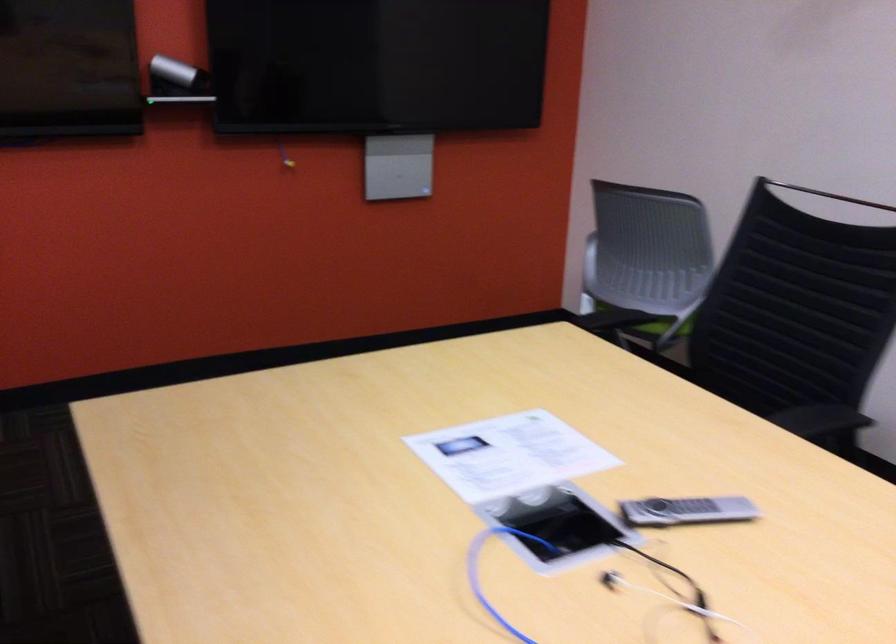
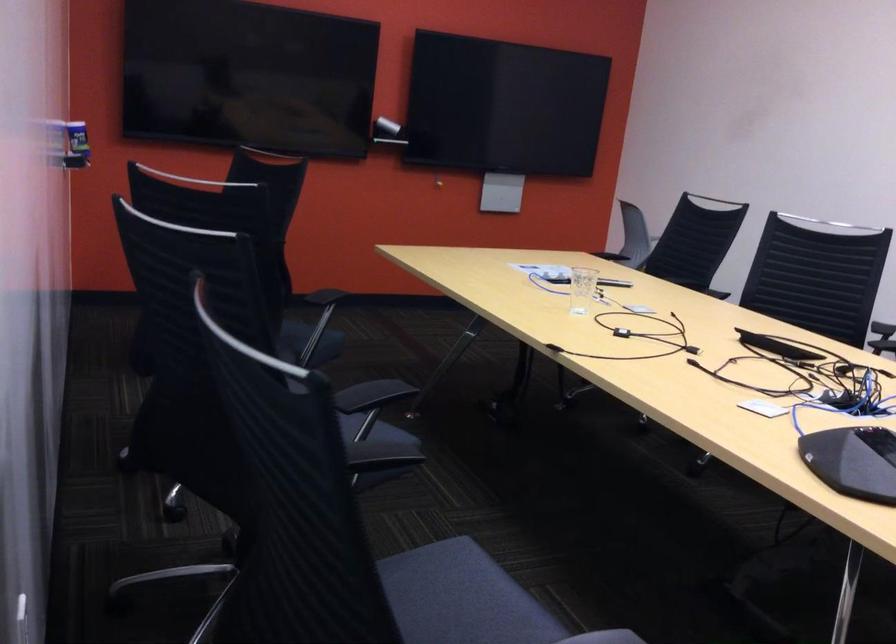
Question: I am providing you with two images of the same scene from different viewpoints. Please identify which objects are invisible in image2.

Choices:
 (A) black remote control
 (B) yellow plunger handle
 (C) black chair sitting surface
 (D) chair sitting surface

Answer: (D)